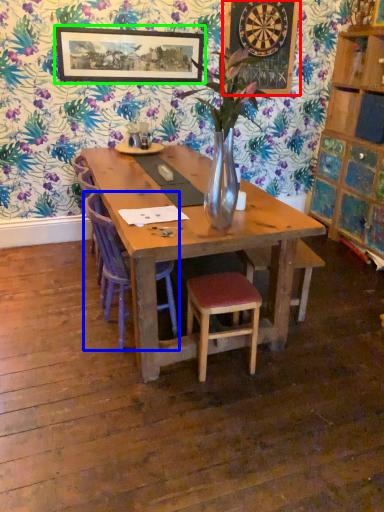
Question: Which object is the closest to the bulletin board (highlighted by a red box)? Choose among these: chair (highlighted by a blue box) or picture frame (highlighted by a green box).

Choices:
 (A) chair
 (B) picture frame

Answer: (B)